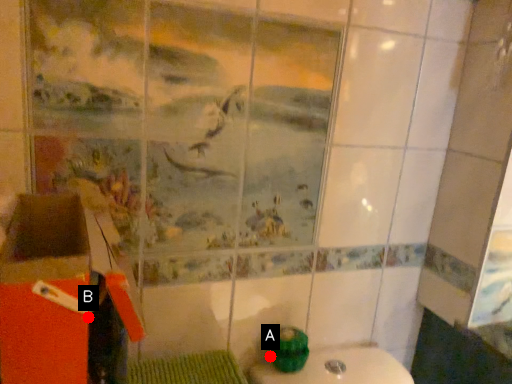
Question: Two points are circled on the image, labeled by A and B beside each circle. Which point is farther from the camera taking this photo?

Choices:
 (A) A is further
 (B) B is further

Answer: (A)